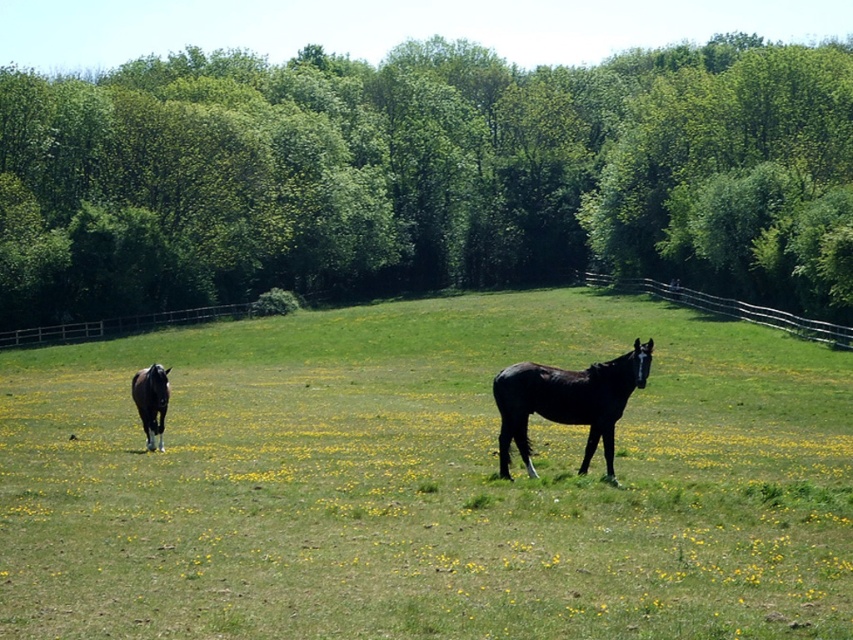
Question: Which object is the closest to the black glossy horse at center?

Choices:
 (A) green leafy trees at upper center
 (B) wooden fence at upper right

Answer: (B)

Question: Estimate the real-world distances between objects in this image. Which object is farther from the green leafy trees at upper center?

Choices:
 (A) green grass pasture at center
 (B) shiny black horse at lower left

Answer: (B)

Question: From the image, what is the correct spatial relationship of black glossy horse at center in relation to wooden fence at upper right?

Choices:
 (A) below
 (B) above

Answer: (A)

Question: Is the position of shiny black horse at lower left less distant than that of wooden fence at upper right?

Choices:
 (A) no
 (B) yes

Answer: (B)

Question: Is green leafy trees at upper center thinner than black glossy horse at center?

Choices:
 (A) yes
 (B) no

Answer: (B)

Question: Which object is the closest to the green leafy trees at upper center?

Choices:
 (A) shiny black horse at lower left
 (B) green grass pasture at center

Answer: (B)